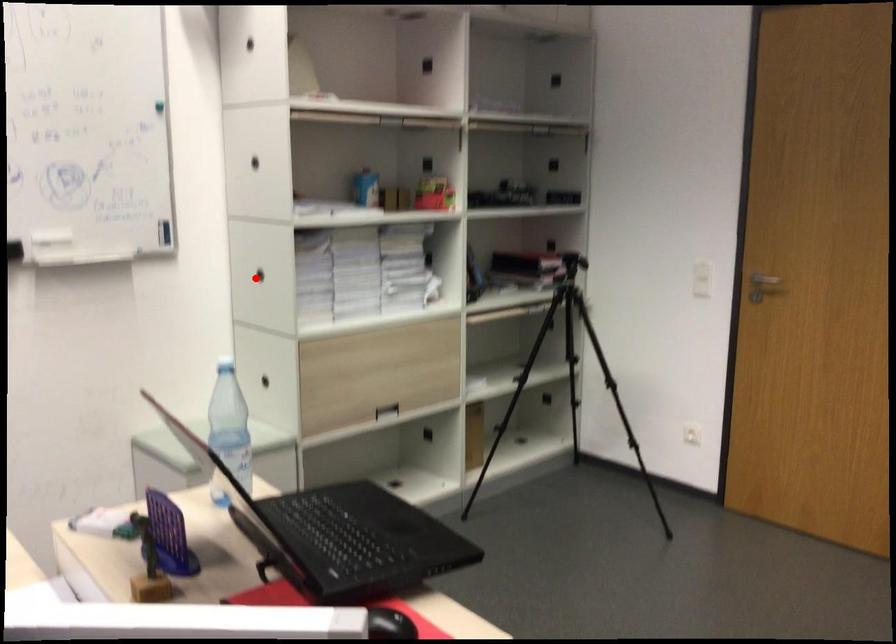
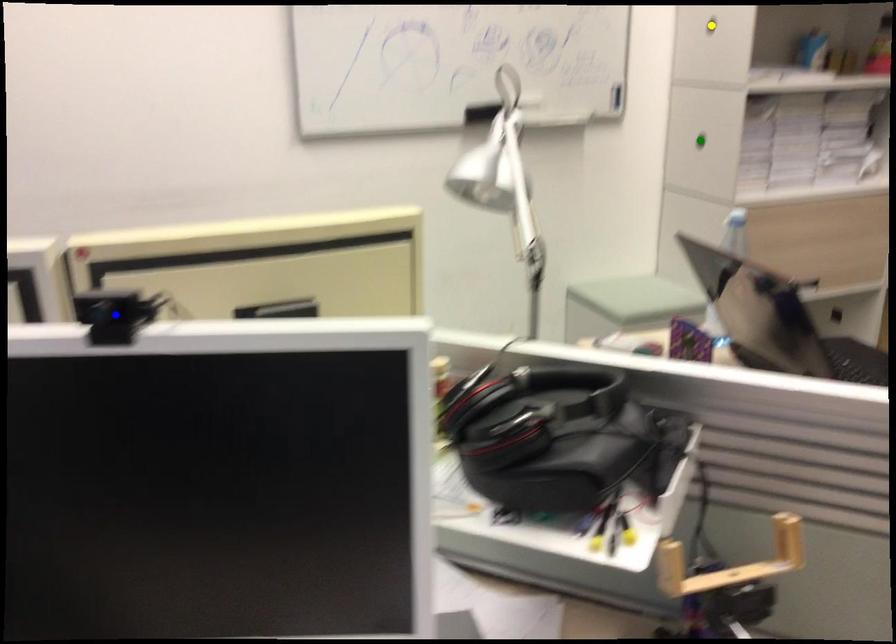
Question: I am providing you with two images of the same scene from different viewpoints. A red point is marked on the first image. You are given multiple points on the second image. Which spot in image 2 lines up with the point in image 1?

Choices:
 (A) yellow point
 (B) blue point
 (C) green point

Answer: (C)